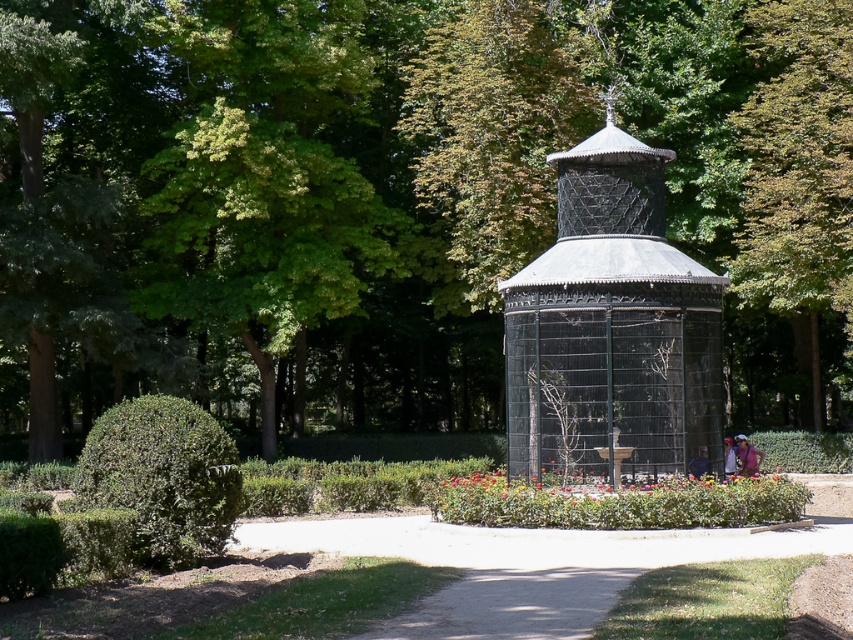
Is point (648, 358) more distant than point (134, 468)?

Yes.

Is black metal gazebo at center above green leafy hedge at lower left?

Yes, black metal gazebo at center is above green leafy hedge at lower left.

In the scene shown: Who is more distant from viewer, (x=666, y=154) or (x=225, y=458)?

The point (x=666, y=154) is more distant.

You are a GUI agent. You are given a task and a screenshot of the screen. Output one action in this format:
    pyautogui.click(x=<x>, y=<y>)
    Task: Click on the black metal gazebo at center
    
    Given the screenshot: What is the action you would take?
    pyautogui.click(x=612, y=326)

Which is above, black metal cage at center or green leafy hedge at lower left?

black metal cage at center is above.

Can you confirm if black metal cage at center is bigger than green leafy hedge at lower left?

Correct, black metal cage at center is larger in size than green leafy hedge at lower left.

Who is more distant from viewer, (x=612, y=412) or (x=120, y=496)?

Point (x=612, y=412)

Locate an element on the screen. This screenshot has width=853, height=640. black metal cage at center is located at coordinates (612, 378).

Can you confirm if green leafy tree at center is thinner than black metal cage at center?

No.

Is green leafy tree at center above black metal cage at center?

Yes, green leafy tree at center is above black metal cage at center.

Which is in front, point (474, 28) or point (579, 305)?

Point (579, 305) is in front.

The image size is (853, 640). In order to click on green leafy tree at center in this screenshot , I will do `click(402, 196)`.